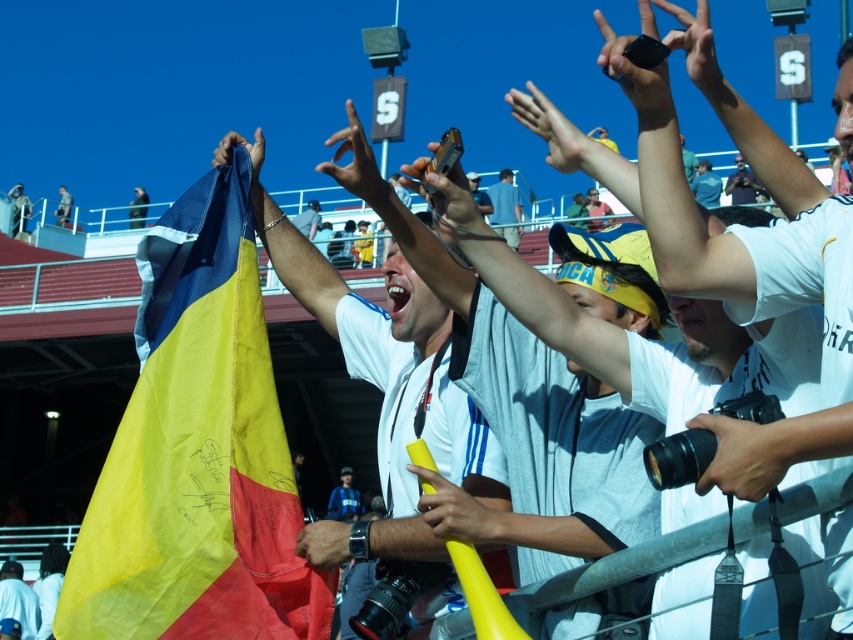
You are a photographer at the soccer match and need to position yourself so that both the white matte shirt at upper center and the brown leather wristwatch at center are visible in your shot. Which object should you place on the left side of your frame to ensure both are captured?

To ensure both the white matte shirt at upper center and the brown leather wristwatch at center are visible, you should place the brown leather wristwatch at center on the left side of your frame since the white matte shirt at upper center is to the right of it.

You are a photographer standing at the edge of the soccer field. You notice the white matte shirt at upper center and the brown leather wristwatch at center in your viewfinder. Which object is taller in the frame?

The white matte shirt at upper center has a greater height compared to the brown leather wristwatch at center, so the white matte shirt at upper center is taller in the frame.

You are a photographer at the soccer match and you notice the smooth black camera at center and the brown leather wristwatch at center. Which object is closer to you as you look at them?

The smooth black camera at center is closer to you because it is in front of the brown leather wristwatch at center.